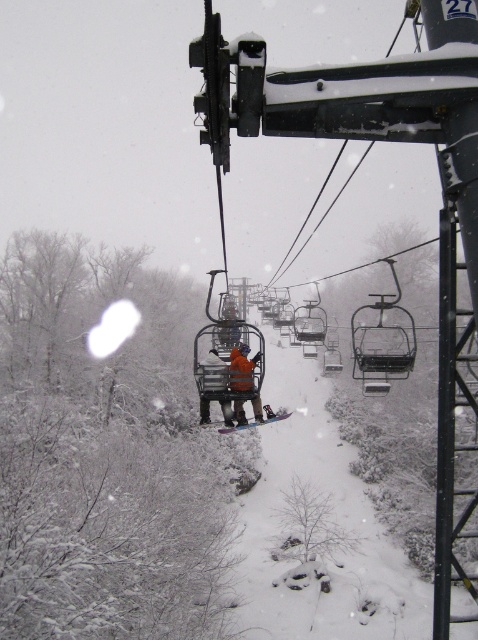
Question: Does orange fleece jacket at center appear on the left side of orange fabric jacket at center?

Choices:
 (A) yes
 (B) no

Answer: (B)

Question: Is orange fleece jacket at center below orange fabric jacket at center?

Choices:
 (A) yes
 (B) no

Answer: (B)

Question: Which point appears farthest from the camera in this image?

Choices:
 (A) (199, 404)
 (B) (235, 369)

Answer: (A)

Question: Which of the following is the farthest from the observer?

Choices:
 (A) orange fleece jacket at center
 (B) orange fabric jacket at center

Answer: (A)

Question: Among these objects, which one is nearest to the camera?

Choices:
 (A) orange fleece jacket at center
 (B) orange fabric jacket at center

Answer: (B)

Question: Is the position of orange fleece jacket at center less distant than that of orange fabric jacket at center?

Choices:
 (A) yes
 (B) no

Answer: (B)